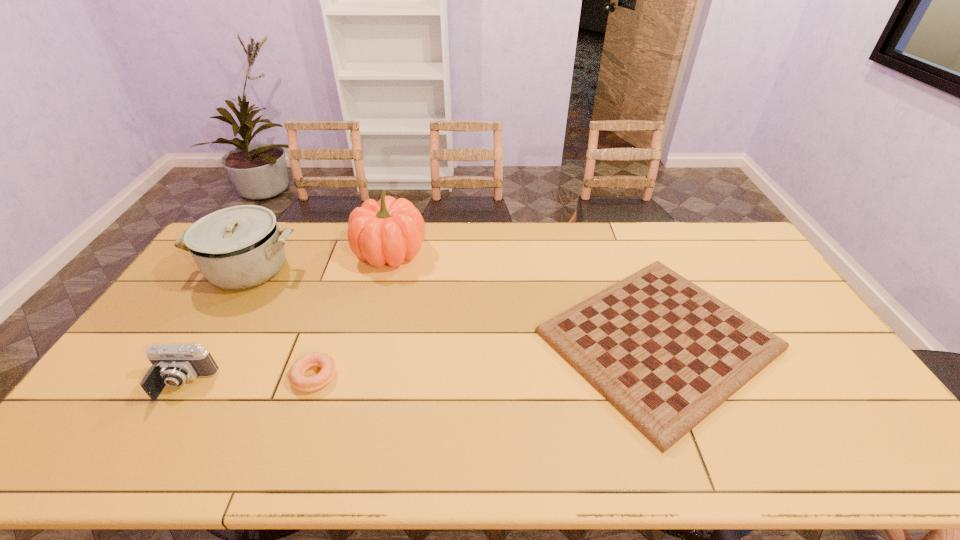
I want to click on pumpkin, so click(x=391, y=230).

You are a GUI agent. You are given a task and a screenshot of the screen. Output one action in this format:
    pyautogui.click(x=<x>, y=<y>)
    Task: Click on the second tallest object
    The width and height of the screenshot is (960, 540).
    Given the screenshot: What is the action you would take?
    pyautogui.click(x=239, y=247)

At what (x,y) coordinates should I click in order to perform the action: click on the third tallest object. Please return your answer as a coordinate pair (x, y). Looking at the image, I should click on (172, 364).

You are a GUI agent. You are given a task and a screenshot of the screen. Output one action in this format:
    pyautogui.click(x=<x>, y=<y>)
    Task: Click on the bagel
    Image resolution: width=960 pixels, height=540 pixels.
    Given the screenshot: What is the action you would take?
    pyautogui.click(x=296, y=375)

Find the location of a particular element. the rightmost object is located at coordinates (665, 353).

Image resolution: width=960 pixels, height=540 pixels. I want to click on vacant space located 0.300m on the left of the tallest object, so click(271, 252).

Find the location of `vacant space located on the right of the saucepan`. vacant space located on the right of the saucepan is located at coordinates (396, 270).

Where is `vacant space located at the front of the third shortest object with an open lens cover`? The image size is (960, 540). vacant space located at the front of the third shortest object with an open lens cover is located at coordinates (135, 464).

Where is `free space located on the back of the bagel`? This screenshot has height=540, width=960. free space located on the back of the bagel is located at coordinates coord(337,310).

Find the location of a particular element. Image resolution: width=960 pixels, height=540 pixels. vacant space located 0.060m on the right of the rightmost object is located at coordinates (802, 340).